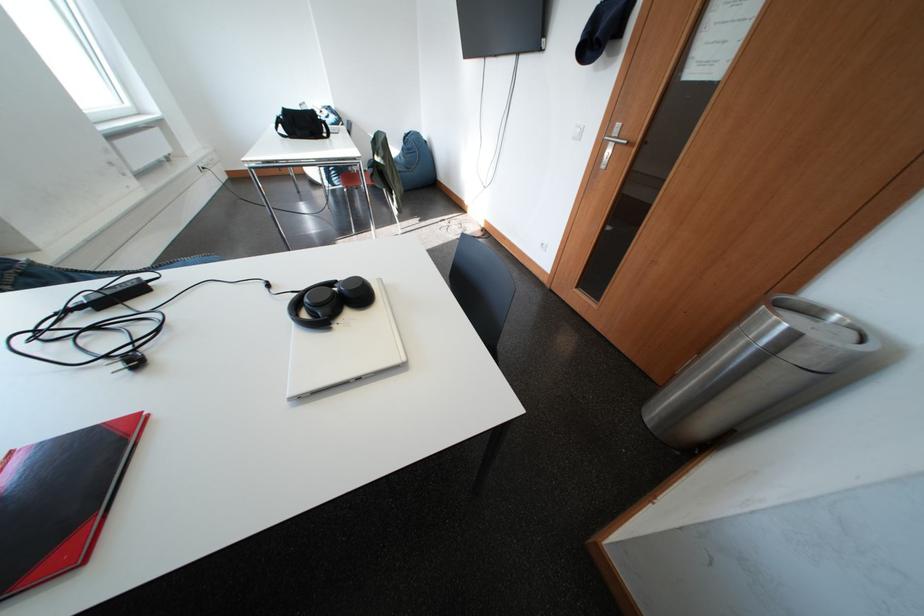
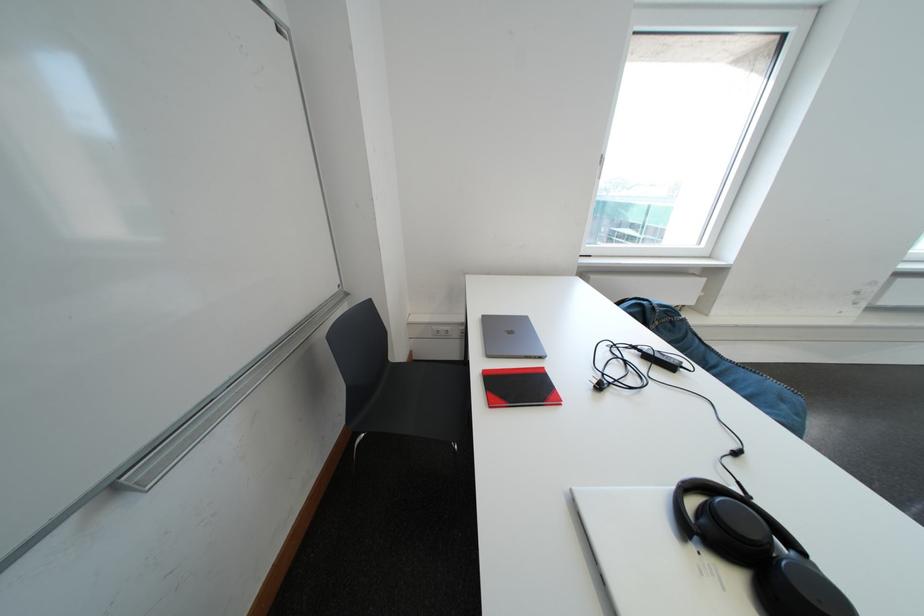
The images are taken continuously from a first-person perspective. In which direction is your viewpoint rotating?

The rotation direction of the camera is left-down.